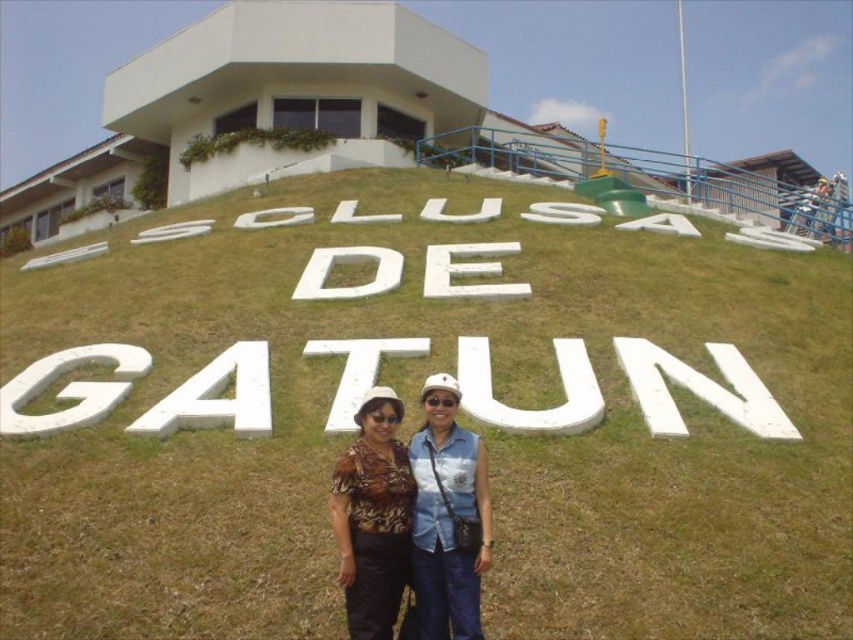
Question: Which object appears farthest from the camera in this image?

Choices:
 (A) green grassy at center
 (B) printed fabric shirt at center

Answer: (A)

Question: Is green grassy at center positioned before printed fabric shirt at center?

Choices:
 (A) no
 (B) yes

Answer: (A)

Question: Which of the following is the farthest from the observer?

Choices:
 (A) printed fabric shirt at center
 (B) green grassy at center

Answer: (B)

Question: Is green grassy at center wider than printed fabric shirt at center?

Choices:
 (A) no
 (B) yes

Answer: (B)

Question: Can you confirm if green grassy at center is positioned below printed fabric shirt at center?

Choices:
 (A) yes
 (B) no

Answer: (B)